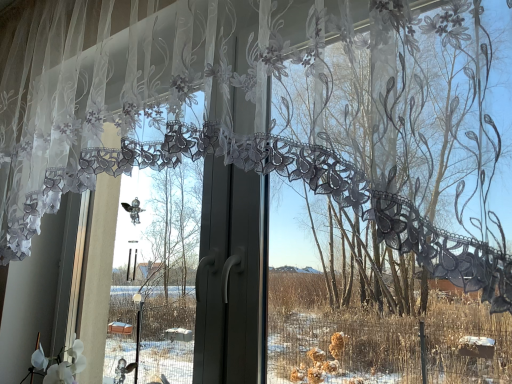
Image resolution: width=512 pixels, height=384 pixels. I want to click on white matte flower at lower left, so click(x=59, y=364).

Describe the element at coordinates (59, 364) in the screenshot. Image resolution: width=512 pixels, height=384 pixels. I see `white matte flower at lower left` at that location.

At what (x,y) coordinates should I click in order to perform the action: click on white matte flower at lower left. Please return your answer as a coordinate pair (x, y). Looking at the image, I should click on (59, 364).